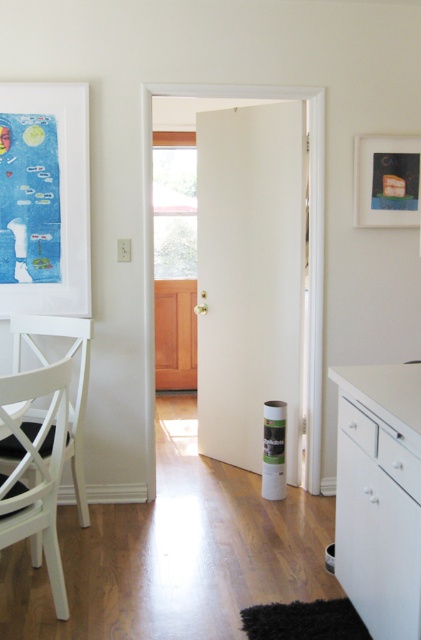
From the picture: You are a delivery person carrying a large box and need to navigate through the hallway. The box is too tall to bend, so you must move it horizontally. There is a white glossy cabinet at lower right and a matte black picture frame at upper right in your path. Which object do you need to avoid hitting with the top of the box as you move through?

The matte black picture frame at upper right is higher up, so you need to avoid hitting the top of the box with the matte black picture frame at upper right.

You are moving a large painting and need to know the spatial relationship between the white glossy cabinet at lower right and the matte black picture frame at upper right. Which object is located to the left of the other?

The white glossy cabinet at lower right is positioned on the left side of matte black picture frame at upper right, so the cabinet is to the left of the frame.

You are standing in the hallway and need to place a new plant pot that is 1 meter tall. The plant pot must be placed exactly at the coordinates given for the white glossy cabinet at lower right. Is there enough space for the plant pot at that location?

The white glossy cabinet at lower right is positioned at point (380, 497). Since the plant pot is 1 meter tall, but the cabinet itself does not have a specified height, we cannot determine if there is enough vertical space. However, the coordinates indicate the cabinet is at the lower right, suggesting it might be near the floor. Therefore, placing the plant pot there may be possible, but the exact space availability is unclear without more information on the cabinet dimensions.